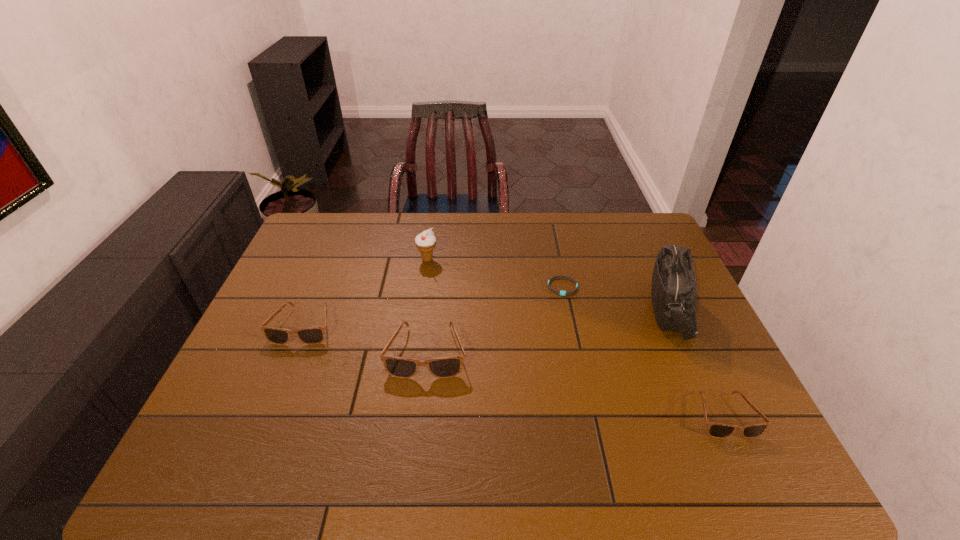
This screenshot has width=960, height=540. Identify the location of shoulder bag that is at the right edge. (673, 289).

You are a GUI agent. You are given a task and a screenshot of the screen. Output one action in this format:
    pyautogui.click(x=<x>, y=<y>)
    Task: Click on the object that is at the near right corner
    This screenshot has height=540, width=960.
    Given the screenshot: What is the action you would take?
    pyautogui.click(x=716, y=430)

I want to click on vacant space at the far edge, so click(438, 225).

The height and width of the screenshot is (540, 960). In the image, there is a desktop. Identify the location of vacant space at the near edge. (331, 416).

Locate an element on the screen. The width and height of the screenshot is (960, 540). vacant region at the left edge of the desktop is located at coordinates (327, 266).

In order to click on free space at the right edge of the desktop in this screenshot , I will do `click(710, 357)`.

Locate an element on the screen. This screenshot has height=540, width=960. vacant space at the far left corner of the desktop is located at coordinates (302, 253).

The image size is (960, 540). In the image, there is a desktop. Find the location of `free space at the far right corner`. free space at the far right corner is located at coordinates (635, 226).

Locate an element on the screen. empty location between the tallest object and the leftmost object is located at coordinates (488, 318).

Identify the location of vacant point located between the leftmost sunglasses and the tallest sunglasses. (366, 339).